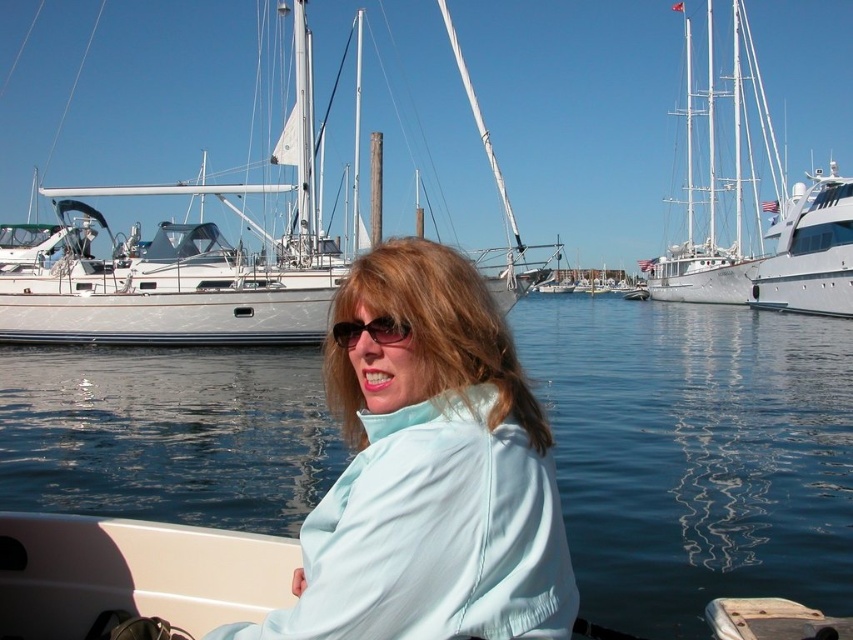
Image resolution: width=853 pixels, height=640 pixels. Describe the element at coordinates (721, 173) in the screenshot. I see `white glossy sailboat at upper center` at that location.

Which is more to the left, white glossy sailboat at upper center or matte black sunglasses at center?

Positioned to the left is matte black sunglasses at center.

Does point (747, 253) come behind point (401, 332)?

Yes, it is behind point (401, 332).

Where is `white glossy sailboat at upper center`? white glossy sailboat at upper center is located at coordinates (721, 173).

Find the location of `clear blue water at center`. clear blue water at center is located at coordinates (695, 452).

Is point (204, 436) positioned behind point (569, 616)?

Yes, point (204, 436) is farther from viewer.

At what (x,y) coordinates should I click in order to perform the action: click on clear blue water at center. Please return your answer as a coordinate pair (x, y). Looking at the image, I should click on (695, 452).

Which is in front, point (351, 417) or point (345, 326)?

Point (345, 326)

Between light blue fabric at center and matte black sunglasses at center, which one is positioned higher?

Positioned higher is matte black sunglasses at center.

Where is `light blue fabric at center`? light blue fabric at center is located at coordinates (428, 474).